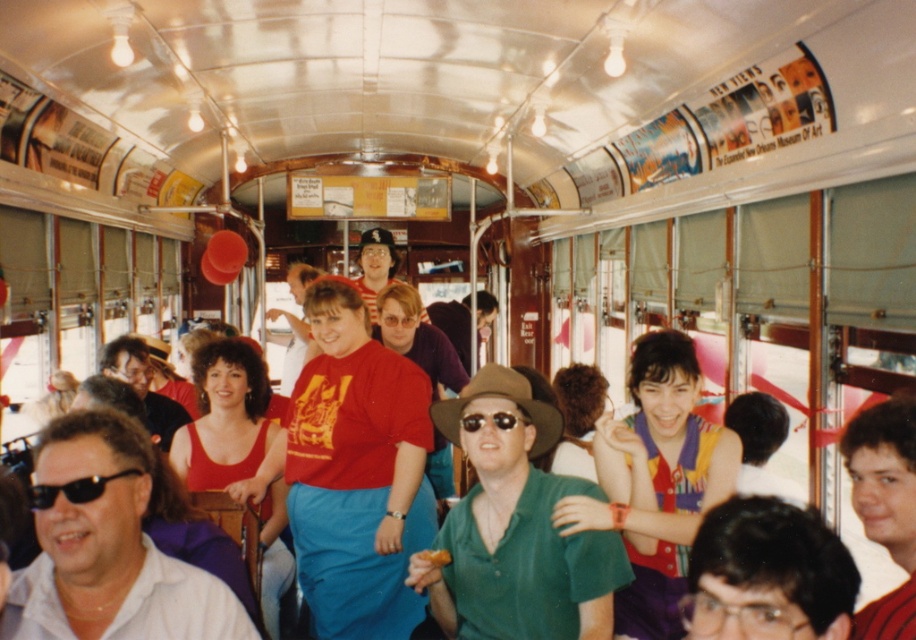
Can you confirm if white matte shirt at lower left is positioned to the left of green cotton shirt at center?

Yes, white matte shirt at lower left is to the left of green cotton shirt at center.

Does white matte shirt at lower left have a lesser height compared to green cotton shirt at center?

No, white matte shirt at lower left is not shorter than green cotton shirt at center.

Identify the location of white matte shirt at lower left. (108, 547).

What do you see at coordinates (516, 531) in the screenshot? Image resolution: width=916 pixels, height=640 pixels. I see `green matte shirt at center` at bounding box center [516, 531].

Is point (536, 456) farther from camera compared to point (71, 612)?

Yes, point (536, 456) is farther from viewer.

Does point (481, 609) lie behind point (62, 540)?

Yes, it is.

Where is `green matte shirt at center`? Image resolution: width=916 pixels, height=640 pixels. green matte shirt at center is located at coordinates (516, 531).

Which is more to the left, green matte shirt at center or green cotton shirt at center?

green matte shirt at center is more to the left.

Is green matte shirt at center to the right of green cotton shirt at center from the viewer's perspective?

Incorrect, green matte shirt at center is not on the right side of green cotton shirt at center.

The image size is (916, 640). What do you see at coordinates (516, 531) in the screenshot? I see `green matte shirt at center` at bounding box center [516, 531].

Locate an element on the screen. The image size is (916, 640). green matte shirt at center is located at coordinates (516, 531).